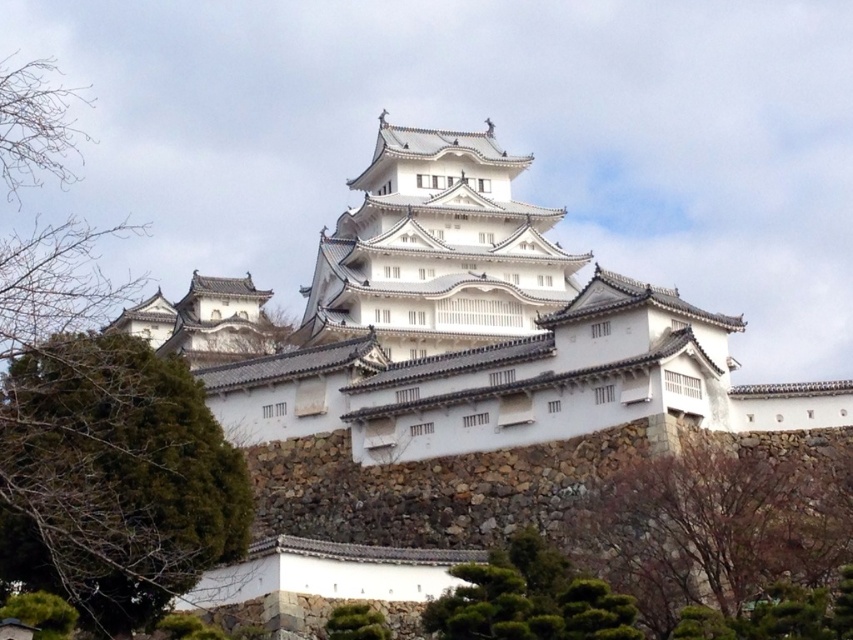
Is white smooth castle at center above brown textured tree at lower right?

Indeed, white smooth castle at center is positioned over brown textured tree at lower right.

Is point (459, 221) closer to camera compared to point (809, 564)?

No, (459, 221) is behind (809, 564).

Identify the location of white smooth castle at center. The height and width of the screenshot is (640, 853). (436, 250).

Between white stone castle at center and brown textured tree at lower right, which one appears on the right side from the viewer's perspective?

brown textured tree at lower right is more to the right.

Is white stone castle at center above brown textured tree at lower right?

Indeed, white stone castle at center is positioned over brown textured tree at lower right.

I want to click on white stone castle at center, so click(x=461, y=326).

Identify the location of white stone castle at center. (461, 326).

Between green leafy tree at center and green mossy rock at lower center, which one appears on the left side from the viewer's perspective?

green leafy tree at center

Who is more forward, [91,358] or [363,618]?

Point [91,358] is more forward.

The image size is (853, 640). Identify the location of green leafy tree at center. (113, 477).